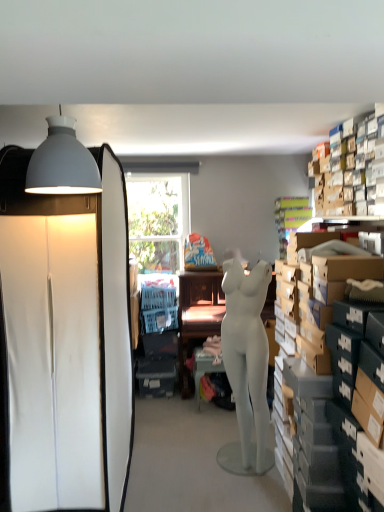
Question: From a real-world perspective, is matte brown desk at center on top of matte gray lampshade at upper left?

Choices:
 (A) yes
 (B) no

Answer: (B)

Question: Is matte brown desk at center positioned in front of matte gray lampshade at upper left?

Choices:
 (A) no
 (B) yes

Answer: (A)

Question: Can you confirm if matte brown desk at center is smaller than matte gray lampshade at upper left?

Choices:
 (A) yes
 (B) no

Answer: (B)

Question: Is matte brown desk at center with matte gray lampshade at upper left?

Choices:
 (A) yes
 (B) no

Answer: (B)

Question: Considering the relative positions of matte brown desk at center and matte gray lampshade at upper left in the image provided, is matte brown desk at center behind matte gray lampshade at upper left?

Choices:
 (A) no
 (B) yes

Answer: (B)

Question: In terms of size, does white matte mannequin at center appear bigger or smaller than matte gray table at center?

Choices:
 (A) small
 (B) big

Answer: (B)

Question: From a real-world perspective, is white matte mannequin at center physically located above or below matte gray table at center?

Choices:
 (A) below
 (B) above

Answer: (B)

Question: Considering their positions, is white matte mannequin at center located in front of or behind matte gray table at center?

Choices:
 (A) behind
 (B) front

Answer: (B)

Question: From the image's perspective, is white matte mannequin at center located above or below matte gray table at center?

Choices:
 (A) above
 (B) below

Answer: (A)

Question: Is matte gray table at center situated inside matte gray lampshade at upper left or outside?

Choices:
 (A) outside
 (B) inside

Answer: (A)

Question: Looking at the image, does matte gray table at center seem bigger or smaller compared to matte gray lampshade at upper left?

Choices:
 (A) small
 (B) big

Answer: (B)

Question: Based on their positions, is matte gray table at center located to the left or right of matte gray lampshade at upper left?

Choices:
 (A) right
 (B) left

Answer: (A)

Question: From the image's perspective, is matte gray table at center positioned above or below matte gray lampshade at upper left?

Choices:
 (A) above
 (B) below

Answer: (B)

Question: In terms of height, does matte gray lampshade at upper left look taller or shorter compared to white matte cabinet at left?

Choices:
 (A) short
 (B) tall

Answer: (A)

Question: Do you think matte gray lampshade at upper left is within white matte cabinet at left, or outside of it?

Choices:
 (A) outside
 (B) inside

Answer: (A)